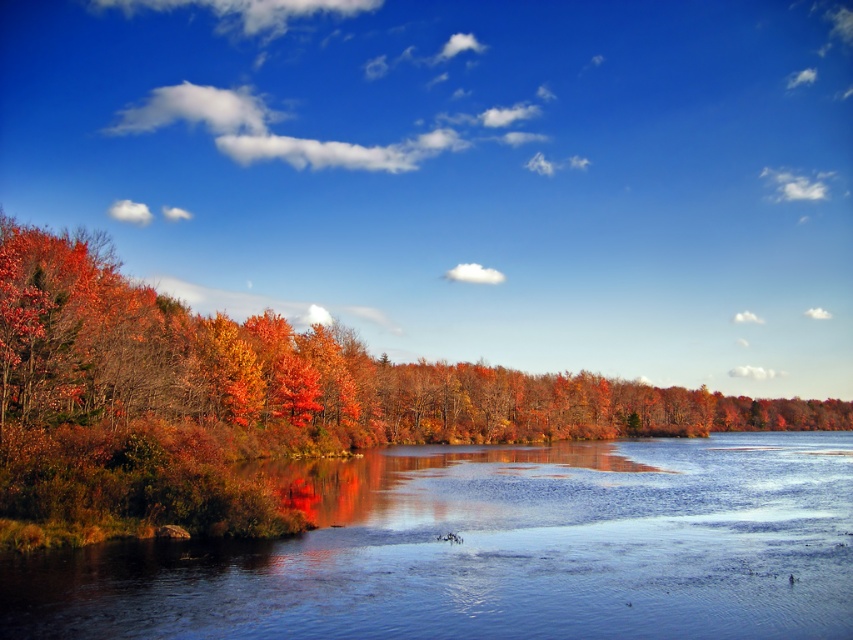
Question: Is smooth reflective water at center positioned before autumn leaves at left?

Choices:
 (A) no
 (B) yes

Answer: (B)

Question: Which object is closer to the camera taking this photo?

Choices:
 (A) autumn leaves at left
 (B) smooth reflective water at center

Answer: (B)

Question: Does smooth reflective water at center appear on the left side of autumn leaves at left?

Choices:
 (A) no
 (B) yes

Answer: (B)

Question: Is smooth reflective water at center closer to the viewer compared to autumn leaves at left?

Choices:
 (A) yes
 (B) no

Answer: (A)